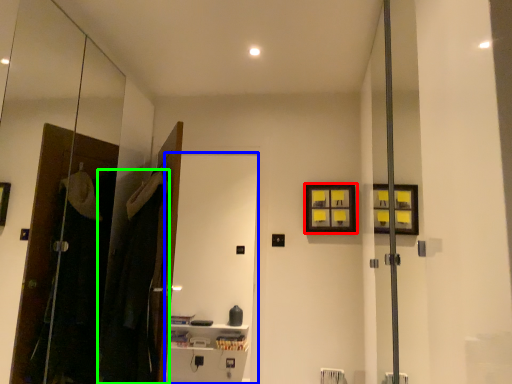
Question: Which object is the farthest from picture frame (highlighted by a red box)? Choose among these: screen door (highlighted by a blue box) or laundry (highlighted by a green box).

Choices:
 (A) screen door
 (B) laundry

Answer: (A)